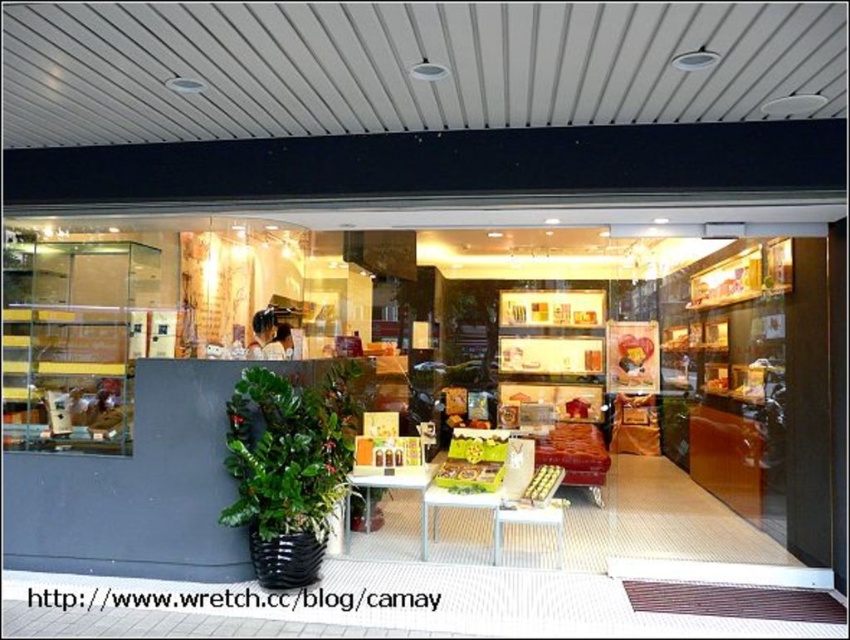
Question: Can you confirm if matte brown furniture at center is positioned to the left of green matte plant at lower left?

Choices:
 (A) yes
 (B) no

Answer: (B)

Question: Among these objects, which one is farthest from the camera?

Choices:
 (A) green matte plant at lower left
 (B) wooden table at center
 (C) matte brown furniture at center

Answer: (C)

Question: Which point is farther to the camera?

Choices:
 (A) (236, 440)
 (B) (514, 465)
 (C) (588, 369)

Answer: (C)

Question: Does matte brown furniture at center appear on the right side of wooden table at center?

Choices:
 (A) no
 (B) yes

Answer: (B)

Question: Among these objects, which one is farthest from the camera?

Choices:
 (A) wooden table at center
 (B) green matte plant at lower left
 (C) matte brown furniture at center
 (D) white glossy table at center

Answer: (C)

Question: Does green matte plant at lower left lie in front of white glossy table at center?

Choices:
 (A) yes
 (B) no

Answer: (A)